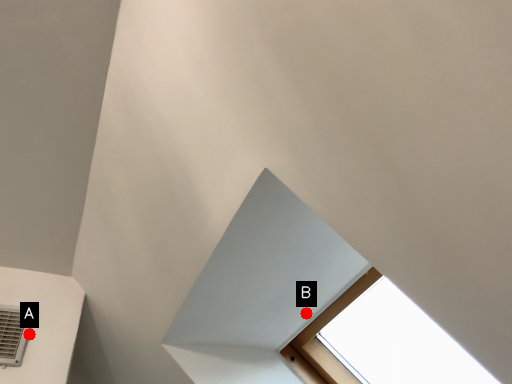
Question: Two points are circled on the image, labeled by A and B beside each circle. Which point appears closest to the camera in this image?

Choices:
 (A) A is closer
 (B) B is closer

Answer: (B)